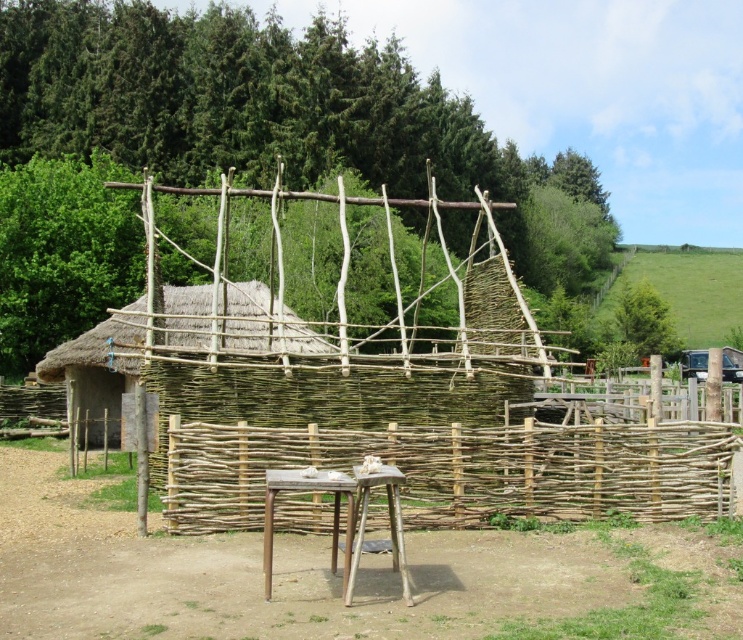
Question: Among these objects, which one is nearest to the camera?

Choices:
 (A) wooden picnic table at center
 (B) natural wood fence at center
 (C) brown dirt field at center

Answer: (C)

Question: Estimate the real-world distances between objects in this image. Which object is farther from the natural wood fence at center?

Choices:
 (A) thatched straw hut at center
 (B) wooden picnic table at center
 (C) brown dirt field at center

Answer: (A)

Question: Is the position of brown dirt field at center less distant than that of thatched straw hut at center?

Choices:
 (A) no
 (B) yes

Answer: (B)

Question: Considering the relative positions of thatched straw hut at center and wooden picnic table at center in the image provided, where is thatched straw hut at center located with respect to wooden picnic table at center?

Choices:
 (A) above
 (B) below

Answer: (A)

Question: Based on their relative distances, which object is nearer to the natural wood fence at center?

Choices:
 (A) wooden picnic table at center
 (B) brown dirt field at center
 (C) thatched straw hut at center

Answer: (B)

Question: Is brown dirt field at center wider than wooden picnic table at center?

Choices:
 (A) yes
 (B) no

Answer: (A)